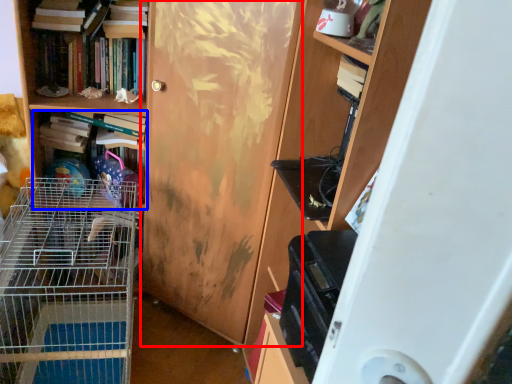
Question: Which point is closer to the camera, door (highlighted by a red box) or book (highlighted by a blue box)?

Choices:
 (A) door
 (B) book

Answer: (A)